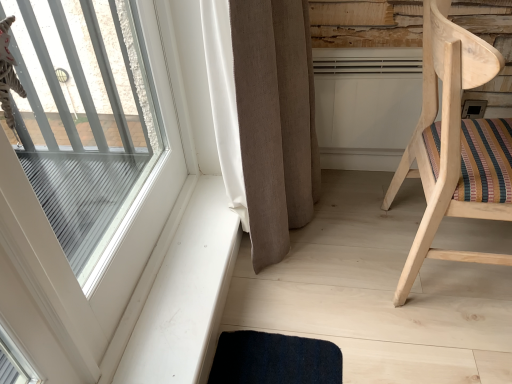
This screenshot has height=384, width=512. Identify the location of vacant space positioned to the left of natural wood chair at right. (331, 285).